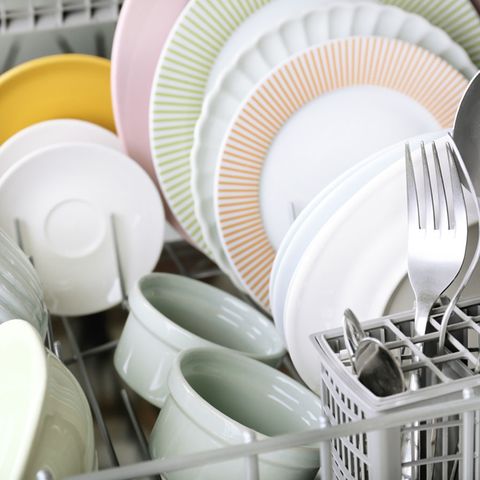
I want to click on colored plates, so click(x=59, y=92), click(x=130, y=50), click(x=193, y=80), click(x=262, y=147).